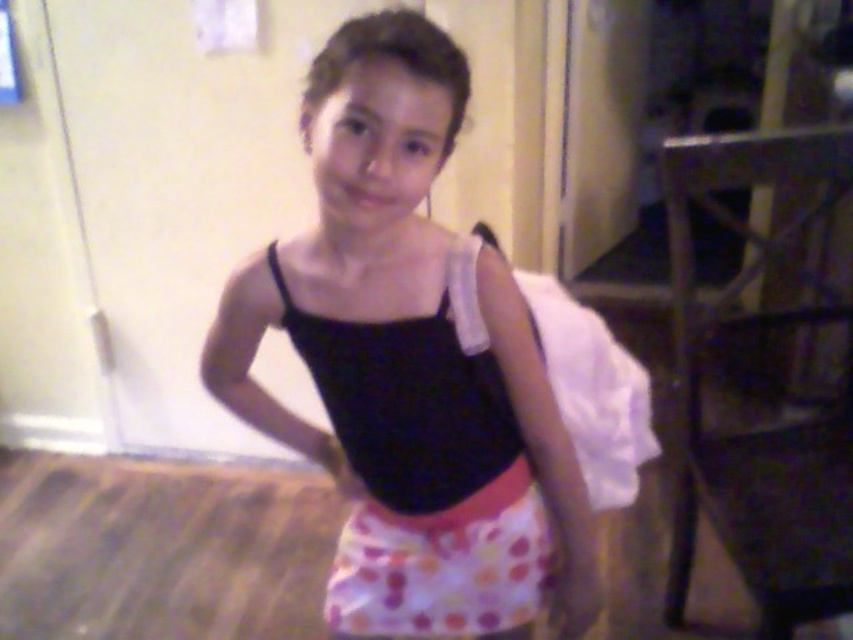
You are a fashion designer observing the image. You need to determine the order of layers for the outfit. Which item is positioned higher on the body between the black spandex leotard at center and the polka dot fabric skirt at center?

The black spandex leotard at center is positioned higher than the polka dot fabric skirt at center, so it is layered above the skirt.

You are a fashion designer observing the image. You need to determine the order of the matte black leotard at center and the polka dot fabric skirt at center from top to bottom. Which one is positioned higher?

The matte black leotard at center is above the polka dot fabric skirt at center, so the matte black leotard at center is positioned higher.

You are a fashion designer trying to create a new outfit. You have two items in front of you, the matte black leotard at center and the polka dot fabric skirt at center. Which item would you choose if you want to use the larger piece for the main part of the outfit?

The matte black leotard at center is larger in size than the polka dot fabric skirt at center, so you should choose the matte black leotard at center for the main part of the outfit.